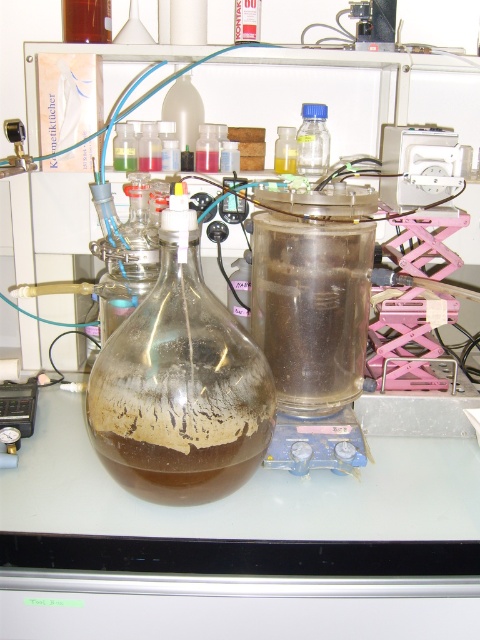
Who is taller, transparent glass bottle at center or translucent plastic test tube at center?

Standing taller between the two is transparent glass bottle at center.

Does point (178, 120) lie in front of point (214, 154)?

No, (178, 120) is behind (214, 154).

Image resolution: width=480 pixels, height=640 pixels. Find the location of `transparent glass bottle at center`. transparent glass bottle at center is located at coordinates (183, 109).

From the picture: Is transparent plastic bottle at upper right further to camera compared to transparent plastic bottle at upper center?

No, transparent plastic bottle at upper right is in front of transparent plastic bottle at upper center.

Does point (308, 132) come in front of point (294, 147)?

Yes.

This screenshot has width=480, height=640. What are the coordinates of `transparent plastic bottle at upper right` in the screenshot? It's located at coord(312,140).

Is point (191, 99) positioned behind point (132, 125)?

Yes, point (191, 99) is farther from viewer.

Identify the location of transparent glass bottle at center. (183, 109).